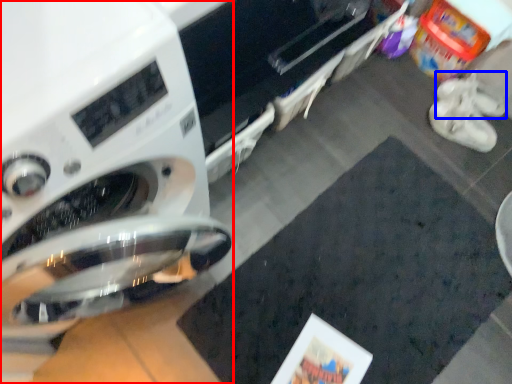
Question: Among these objects, which one is farthest to the camera, washing machine (highlighted by a red box) or shoe (highlighted by a blue box)?

Choices:
 (A) washing machine
 (B) shoe

Answer: (B)